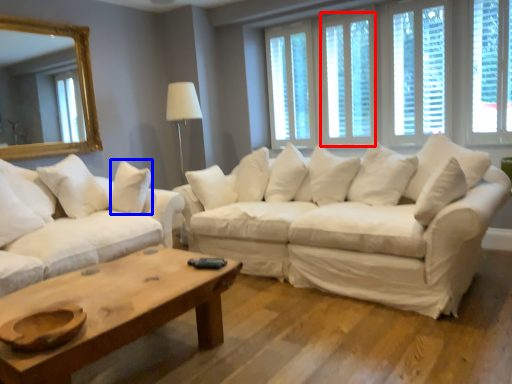
Question: Among these objects, which one is farthest to the camera, window (highlighted by a red box) or pillow (highlighted by a blue box)?

Choices:
 (A) window
 (B) pillow

Answer: (A)